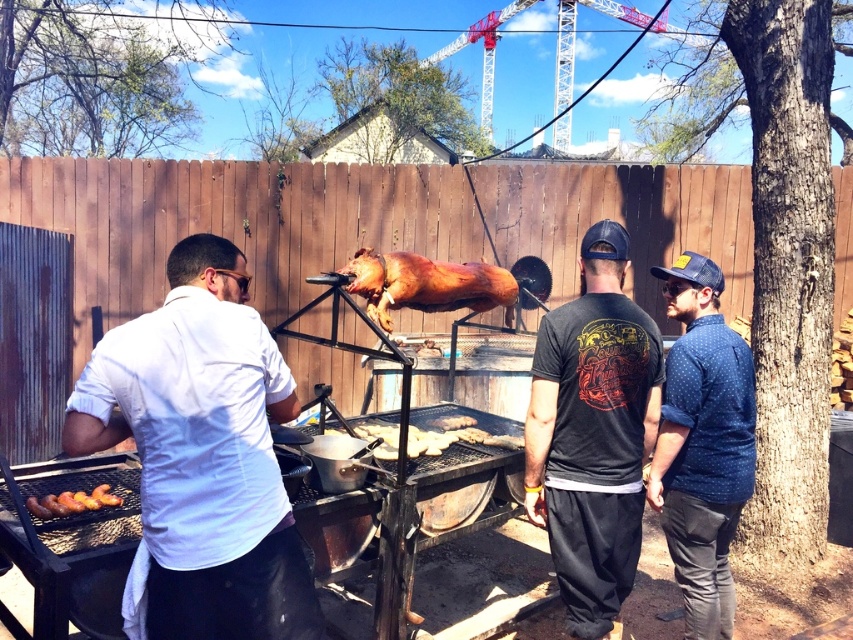
You are a guest at the barbecue and want to take a photo of the golden brown crispy pig at center and the charred wood sausages at lower left. Which object should you focus on first to ensure both are in frame?

You should focus on the golden brown crispy pig at center first because it is much taller than the charred wood sausages at lower left, so adjusting the camera angle to include its height will naturally include the shorter sausages in the frame.

You are a photographer at the barbecue scene. You need to take a photo of the two men wearing the white matte shirt at center and blue dotted shirt at right. The camera you are using has a narrow field of view. Which direction should you pan the camera to include both in the frame?

You should pan the camera to the left to include both the white matte shirt at center and the blue dotted shirt at right in the frame since the white matte shirt at center is positioned to the left of the blue dotted shirt at right.